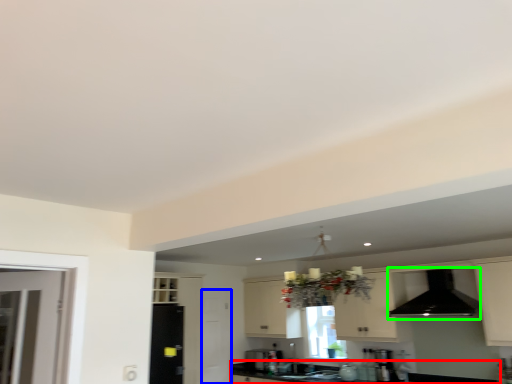
Question: Which object is positioned closest to countertop (highlighted by a red box)? Select from screen door (highlighted by a blue box) and exhaust hood (highlighted by a green box).

Choices:
 (A) screen door
 (B) exhaust hood

Answer: (A)